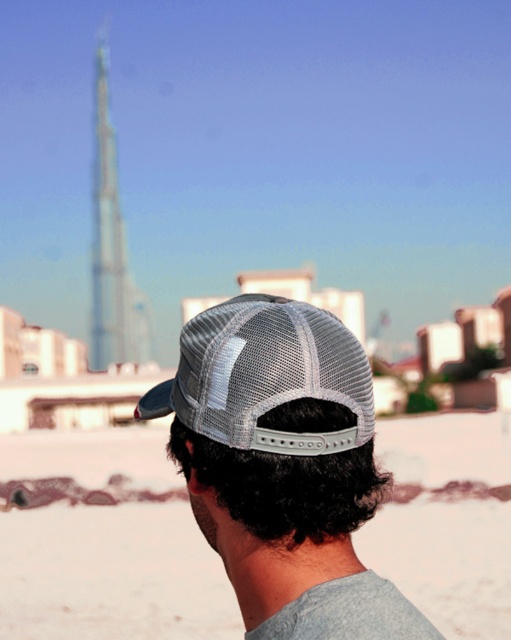
You are standing in the desert near the Burj Khalifa and see two points in the scene. The first point is at coordinates point (469, 596) and the second is at point (285, 372). Which point is closer to you?

Point (469, 596) is further to the viewer than point (285, 372), so the point closer to you is point (285, 372).

You are a photographer trying to capture a photo of the gray mesh baseball cap at center and the white sand at lower center. The camera you are using has a focal length of 50mm. To ensure both objects are in focus, what is the minimum distance you should set the focus point to?

The minimum focus distance should be set to 53.13 meters because the white sand at lower center is 53.13 meters away from the gray mesh baseball cap at center, ensuring both are within the depth of field.